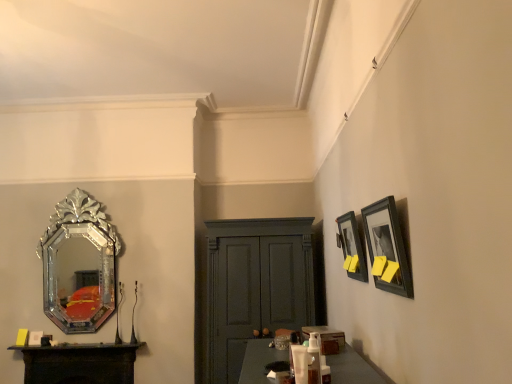
Question: Is matte gray cabinet at center with dark wood table at lower left?

Choices:
 (A) yes
 (B) no

Answer: (B)

Question: From a real-world perspective, is matte gray cabinet at center beneath dark wood table at lower left?

Choices:
 (A) yes
 (B) no

Answer: (B)

Question: Is matte gray cabinet at center positioned with its back to dark wood table at lower left?

Choices:
 (A) yes
 (B) no

Answer: (B)

Question: Considering the relative sizes of matte gray cabinet at center and dark wood table at lower left in the image provided, is matte gray cabinet at center thinner than dark wood table at lower left?

Choices:
 (A) no
 (B) yes

Answer: (A)

Question: From the image's perspective, does matte gray cabinet at center appear higher than dark wood table at lower left?

Choices:
 (A) yes
 (B) no

Answer: (A)

Question: Is matte gray cabinet at center outside of dark wood table at lower left?

Choices:
 (A) yes
 (B) no

Answer: (A)

Question: Could you tell me if matte black picture frame at upper right, marked as the first picture frame in a back-to-front arrangement, is facing dark wood table at lower left?

Choices:
 (A) yes
 (B) no

Answer: (B)

Question: Is matte black picture frame at upper right, the second picture frame viewed from the front, closer to camera compared to dark wood table at lower left?

Choices:
 (A) no
 (B) yes

Answer: (B)

Question: Can you confirm if matte black picture frame at upper right, marked as the first picture frame in a back-to-front arrangement, is smaller than dark wood table at lower left?

Choices:
 (A) yes
 (B) no

Answer: (A)

Question: Is dark wood table at lower left surrounded by matte black picture frame at upper right, marked as the first picture frame in a back-to-front arrangement?

Choices:
 (A) yes
 (B) no

Answer: (B)

Question: Is matte black picture frame at upper right, marked as the first picture frame in a back-to-front arrangement, at the left side of dark wood table at lower left?

Choices:
 (A) no
 (B) yes

Answer: (A)

Question: Are matte black picture frame at upper right, the second picture frame viewed from the front, and dark wood table at lower left making contact?

Choices:
 (A) yes
 (B) no

Answer: (B)

Question: Can you confirm if black matte picture frame at upper right, arranged as the 1th picture frame when viewed from the front, is thinner than silver/glass mirror at left?

Choices:
 (A) yes
 (B) no

Answer: (A)